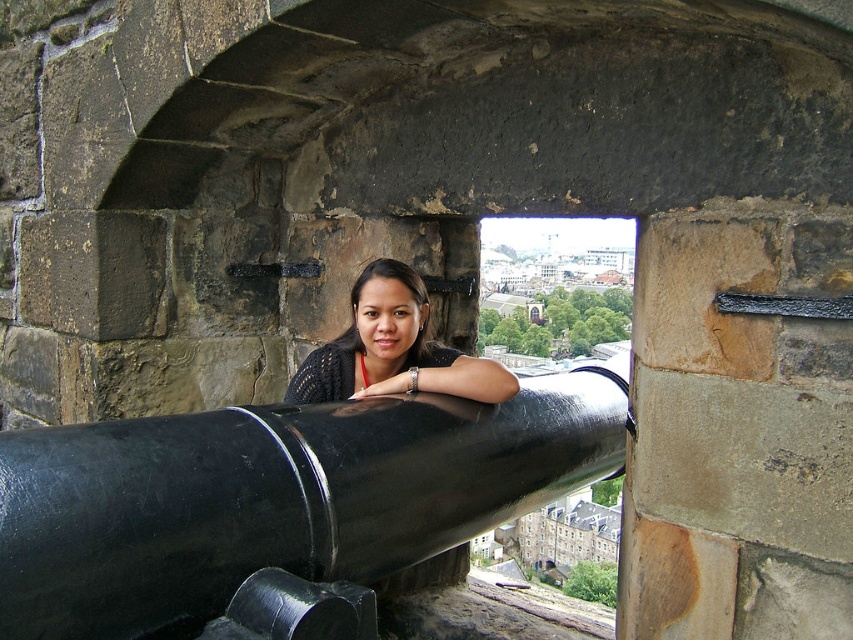
Is black polished cannon at center to the left of matte black sweater at center from the viewer's perspective?

Incorrect, black polished cannon at center is not on the left side of matte black sweater at center.

Does point (219, 556) lie in front of point (409, 337)?

Yes, it is in front of point (409, 337).

Does point (79, 440) come farther from viewer compared to point (424, 356)?

No, it is not.

Where is `black polished cannon at center`? Image resolution: width=853 pixels, height=640 pixels. black polished cannon at center is located at coordinates (277, 497).